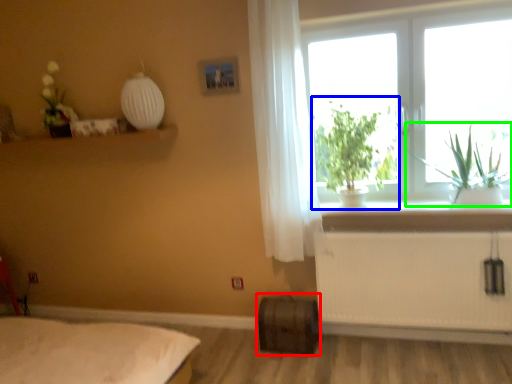
Question: Estimate the real-world distances between objects in this image. Which object is farther from window box (highlighted by a red box), houseplant (highlighted by a blue box) or plant (highlighted by a green box)?

Choices:
 (A) houseplant
 (B) plant

Answer: (B)